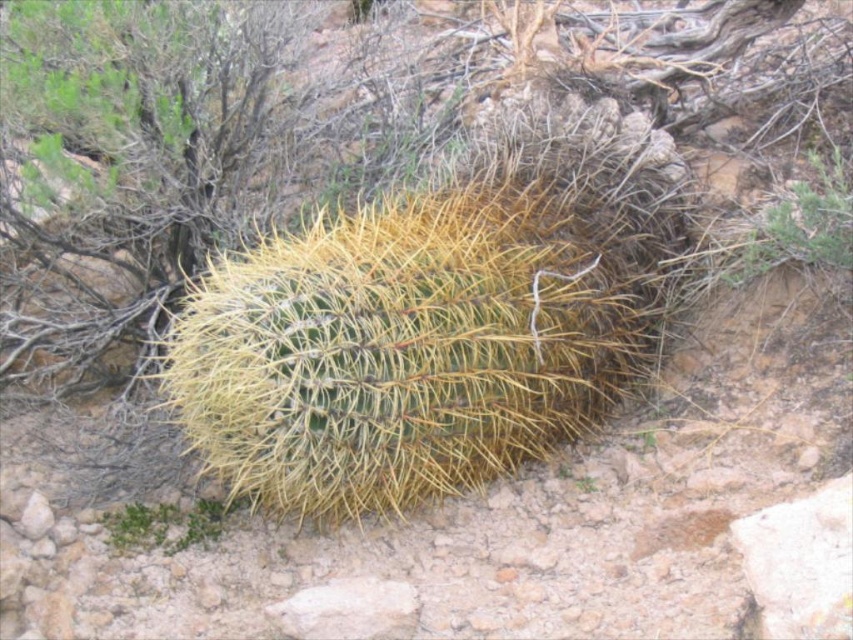
You are standing in the desert scene shown. You see a point labeled as point [799,221]. What object does this point correspond to?

The point [799,221] corresponds to the green spiky cactus at upper right.

You are a hiker trying to navigate through the desert and spot two green spiky cacti. One is at the upper right and the other at the lower left. If you walk directly towards the green spiky cactus at upper right, will the green spiky cactus at lower left become visible behind it?

The green spiky cactus at upper right is in front of the green spiky cactus at lower left, so when you walk towards the upper right cactus, the lower left one will become visible behind it as the upper one moves out of the way.